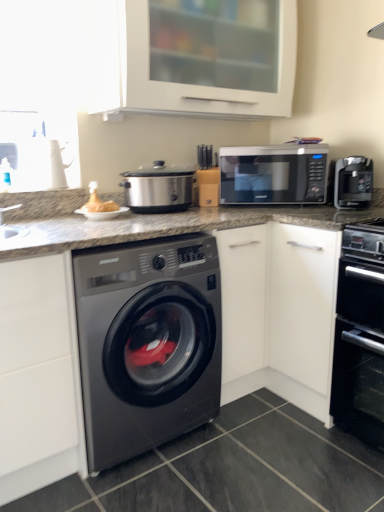
Question: Is black matte oven at lower right behind satin black washing machine at center?

Choices:
 (A) no
 (B) yes

Answer: (B)

Question: Is black matte oven at lower right bigger than satin black washing machine at center?

Choices:
 (A) yes
 (B) no

Answer: (B)

Question: Is black matte oven at lower right not close to satin black washing machine at center?

Choices:
 (A) no
 (B) yes

Answer: (A)

Question: Is black matte oven at lower right closer to camera compared to satin black washing machine at center?

Choices:
 (A) yes
 (B) no

Answer: (B)

Question: Can you confirm if black matte oven at lower right is wider than satin black washing machine at center?

Choices:
 (A) no
 (B) yes

Answer: (A)

Question: Is black matte oven at lower right oriented towards satin black washing machine at center?

Choices:
 (A) no
 (B) yes

Answer: (A)

Question: Is sleek black coffee maker at right further to camera compared to matte brown bread at upper left?

Choices:
 (A) yes
 (B) no

Answer: (A)

Question: Is sleek black coffee maker at right smaller than matte brown bread at upper left?

Choices:
 (A) no
 (B) yes

Answer: (A)

Question: Is sleek black coffee maker at right next to matte brown bread at upper left?

Choices:
 (A) yes
 (B) no

Answer: (B)

Question: Considering the relative positions of sleek black coffee maker at right and matte brown bread at upper left in the image provided, is sleek black coffee maker at right to the left of matte brown bread at upper left from the viewer's perspective?

Choices:
 (A) no
 (B) yes

Answer: (A)

Question: From the image's perspective, would you say sleek black coffee maker at right is shown under matte brown bread at upper left?

Choices:
 (A) yes
 (B) no

Answer: (B)

Question: Is sleek black coffee maker at right wider than matte brown bread at upper left?

Choices:
 (A) yes
 (B) no

Answer: (A)

Question: Is black matte oven at lower right wider than sleek black coffee maker at right?

Choices:
 (A) yes
 (B) no

Answer: (A)